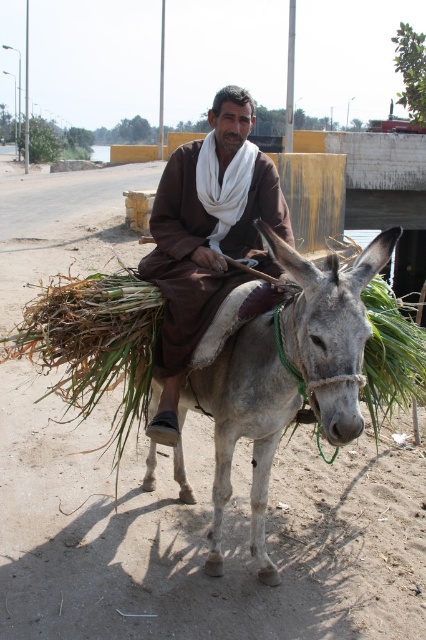
Is gray matte/sand-colored mule at center positioned before green leafy plant at upper right?

Yes.

Between point (264, 362) and point (414, 51), which one is positioned behind?

The point (414, 51) is more distant.

Locate an element on the screen. The image size is (426, 640). gray matte/sand-colored mule at center is located at coordinates (244, 426).

Is green leafy plant at upper right bigger than green leafy plant at center?

Yes, green leafy plant at upper right is bigger than green leafy plant at center.

Between green leafy plant at upper right and green leafy plant at center, which one is positioned lower?

green leafy plant at center is below.

The image size is (426, 640). I want to click on green leafy plant at upper right, so click(411, 70).

At what (x,y) coordinates should I click in order to perform the action: click on green leafy plant at upper right. Please return your answer as a coordinate pair (x, y). Looking at the image, I should click on (411, 70).

Between gray matte/sand-colored mule at center and brown cotton robe at center, which one appears on the left side from the viewer's perspective?

From the viewer's perspective, brown cotton robe at center appears more on the left side.

Is gray matte/sand-colored mule at center positioned at the back of brown cotton robe at center?

No, gray matte/sand-colored mule at center is in front of brown cotton robe at center.

Locate an element on the screen. This screenshot has height=640, width=426. gray matte/sand-colored mule at center is located at coordinates (244, 426).

Where is `gray matte/sand-colored mule at center`? The image size is (426, 640). gray matte/sand-colored mule at center is located at coordinates (244, 426).